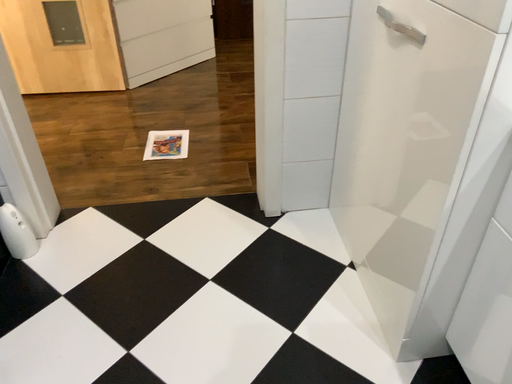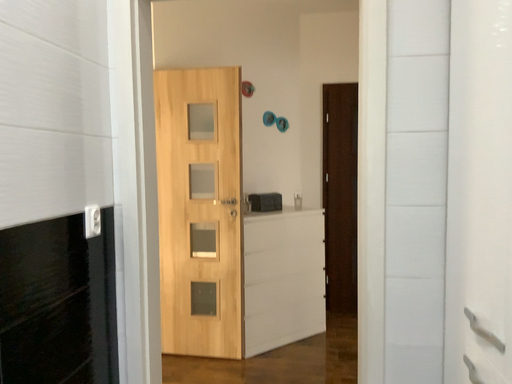
Question: Which way did the camera rotate in the video?

Choices:
 (A) rotated left
 (B) rotated right

Answer: (A)